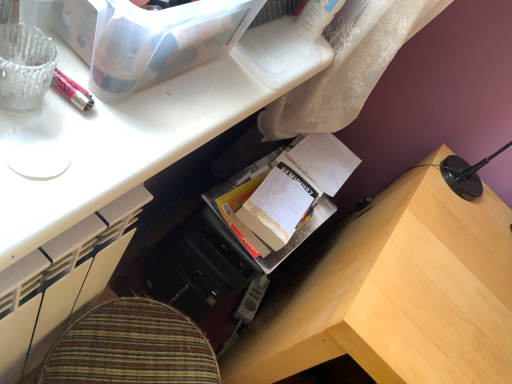
Question: Is wooden desk at center not close to wooden desk at lower right?

Choices:
 (A) no
 (B) yes

Answer: (A)

Question: Is wooden desk at lower right inside wooden desk at center?

Choices:
 (A) no
 (B) yes

Answer: (A)

Question: Would you say wooden desk at center is outside wooden desk at lower right?

Choices:
 (A) yes
 (B) no

Answer: (A)

Question: Is wooden desk at center to the right of wooden desk at lower right from the viewer's perspective?

Choices:
 (A) no
 (B) yes

Answer: (A)

Question: Is wooden desk at center positioned with its back to wooden desk at lower right?

Choices:
 (A) yes
 (B) no

Answer: (B)

Question: Can you confirm if wooden desk at center is positioned to the left of wooden desk at lower right?

Choices:
 (A) yes
 (B) no

Answer: (A)

Question: From the image's perspective, is wooden desk at lower right over translucent glass pen at upper left?

Choices:
 (A) yes
 (B) no

Answer: (B)

Question: Is the position of wooden desk at lower right less distant than that of translucent glass pen at upper left?

Choices:
 (A) no
 (B) yes

Answer: (A)

Question: Can you confirm if wooden desk at lower right is smaller than translucent glass pen at upper left?

Choices:
 (A) no
 (B) yes

Answer: (A)

Question: Does wooden desk at lower right have a greater width compared to translucent glass pen at upper left?

Choices:
 (A) no
 (B) yes

Answer: (B)

Question: Considering the relative sizes of wooden desk at lower right and translucent glass pen at upper left in the image provided, is wooden desk at lower right thinner than translucent glass pen at upper left?

Choices:
 (A) yes
 (B) no

Answer: (B)

Question: Is wooden desk at lower right surrounding translucent glass pen at upper left?

Choices:
 (A) no
 (B) yes

Answer: (A)

Question: Is the surface of wooden desk at lower right in direct contact with cardboard book at center?

Choices:
 (A) yes
 (B) no

Answer: (B)